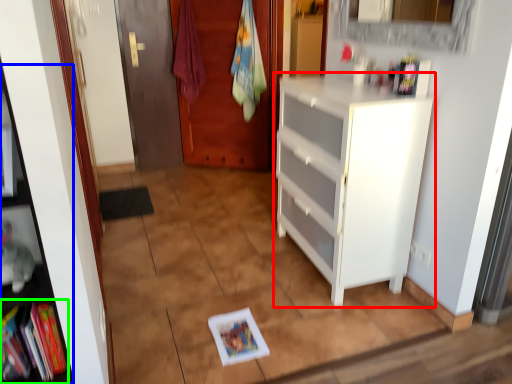
Question: Which is nearer to the cabinetry (highlighted by a red box)? cabinet (highlighted by a blue box) or book (highlighted by a green box).

Choices:
 (A) cabinet
 (B) book

Answer: (A)